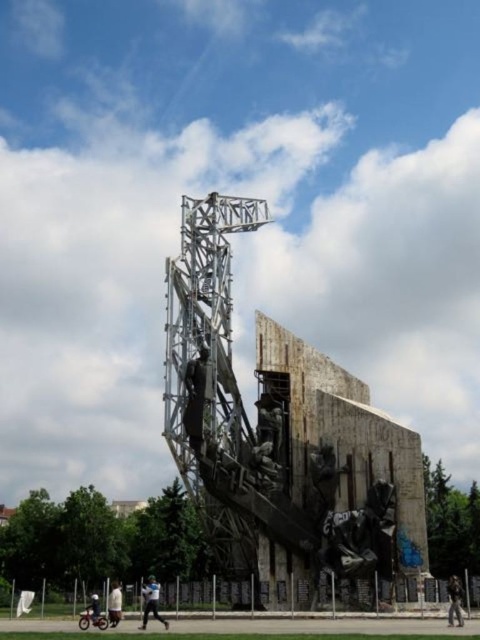
Question: Based on their relative distances, which object is nearer to the dark brown leather jacket at lower right?

Choices:
 (A) white cotton shirt at lower left
 (B) dark blue jeans at lower left

Answer: (A)

Question: Which of these objects is positioned closest to the dark blue jeans at lower left?

Choices:
 (A) dark brown leather jacket at lower right
 (B) light blue shirt at center
 (C) white cotton shirt at lower left

Answer: (C)

Question: Can you confirm if dark brown leather jacket at lower right is smaller than dark blue jeans at lower left?

Choices:
 (A) yes
 (B) no

Answer: (B)

Question: Which object is positioned farthest from the dark blue jeans at lower left?

Choices:
 (A) white cotton shirt at lower left
 (B) dark brown leather jacket at lower right

Answer: (B)

Question: Is dark brown leather jacket at lower right positioned in front of white cotton shirt at lower left?

Choices:
 (A) yes
 (B) no

Answer: (A)

Question: Does dark brown leather jacket at lower right have a larger size compared to white cotton shirt at lower left?

Choices:
 (A) yes
 (B) no

Answer: (A)